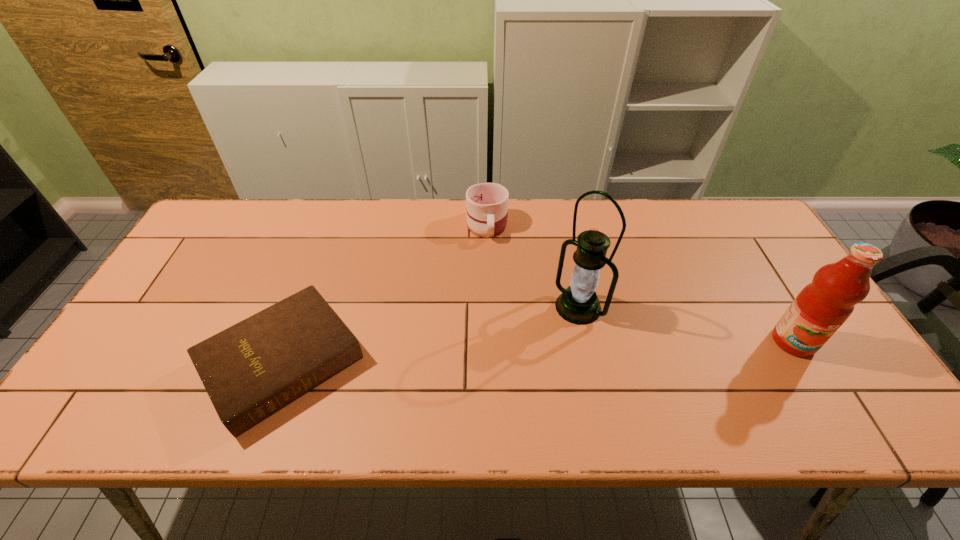
The width and height of the screenshot is (960, 540). What are the coordinates of `vacant spot on the desktop that is between the leftmost object and the fruit juice and is positioned on the side where the second object from right to left emits light` in the screenshot? It's located at (528, 353).

Locate an element on the screen. free space on the desktop that is between the leftmost object and the fruit juice and is positioned on the side with the handle of the farthest object is located at coordinates (490, 355).